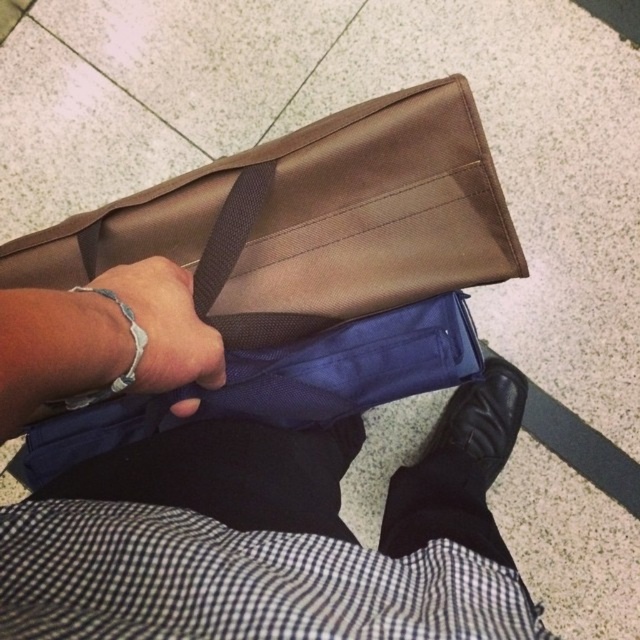
Question: Can you confirm if matte brown bag at upper center is smaller than silver metallic bracelet at center?

Choices:
 (A) no
 (B) yes

Answer: (A)

Question: In this image, where is matte brown bag at upper center located relative to brown fabric strap at center?

Choices:
 (A) right
 (B) left

Answer: (A)

Question: Is matte brown bag at upper center above silver metallic bracelet at center?

Choices:
 (A) no
 (B) yes

Answer: (A)

Question: Based on their relative distances, which object is farther from the silver metallic bracelet at center?

Choices:
 (A) matte brown bag at upper center
 (B) brown fabric strap at center

Answer: (A)

Question: Which point is closer to the camera?

Choices:
 (A) (228, 211)
 (B) (28, 544)

Answer: (B)

Question: Estimate the real-world distances between objects in this image. Which object is farther from the brown fabric strap at center?

Choices:
 (A) matte brown bag at upper center
 (B) silver metallic bracelet at center

Answer: (A)